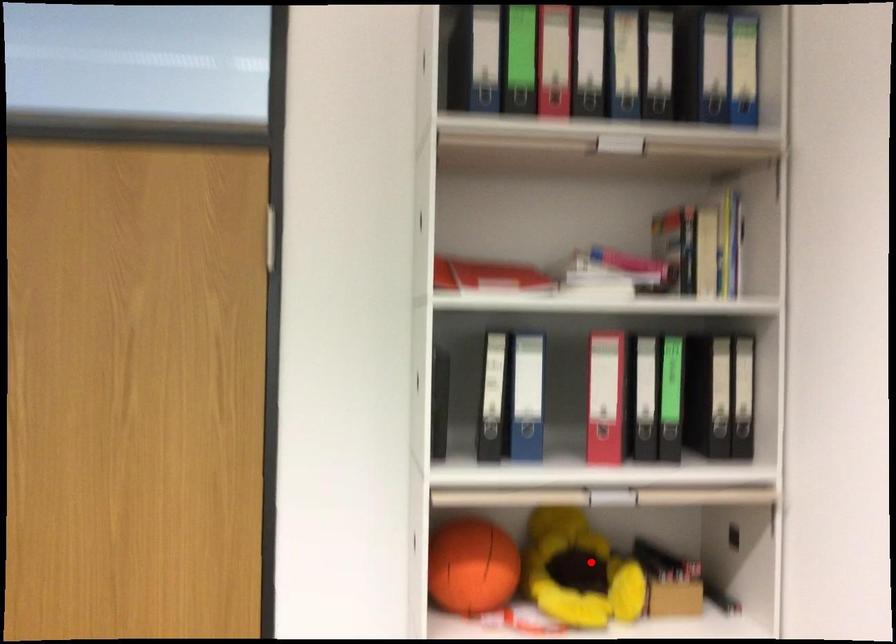
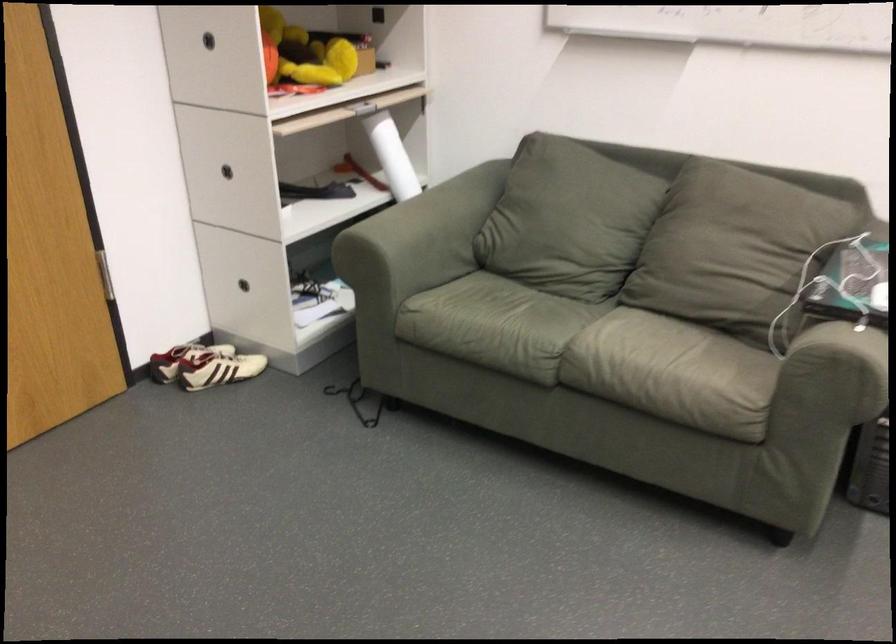
Question: I am providing you with two images of the same scene from different viewpoints. In image1, a red point is highlighted. Considering the same 3D point in image2, which of the following is correct?

Choices:
 (A) It is closer
 (B) It is farther

Answer: (B)